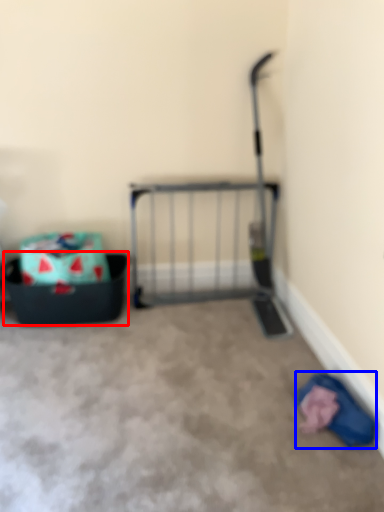
Question: Which of the following is the farthest to the observer, storage box (highlighted by a red box) or clothing (highlighted by a blue box)?

Choices:
 (A) storage box
 (B) clothing

Answer: (A)